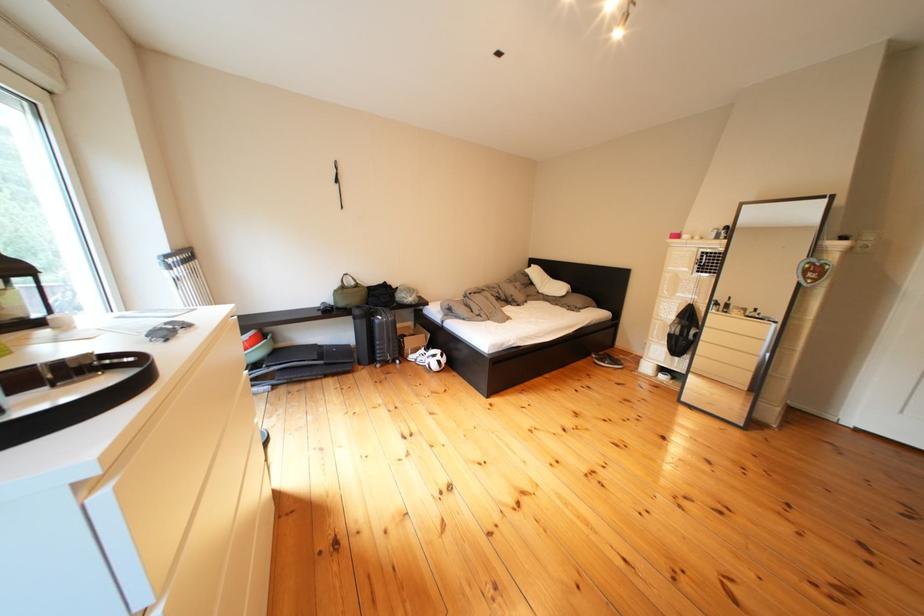
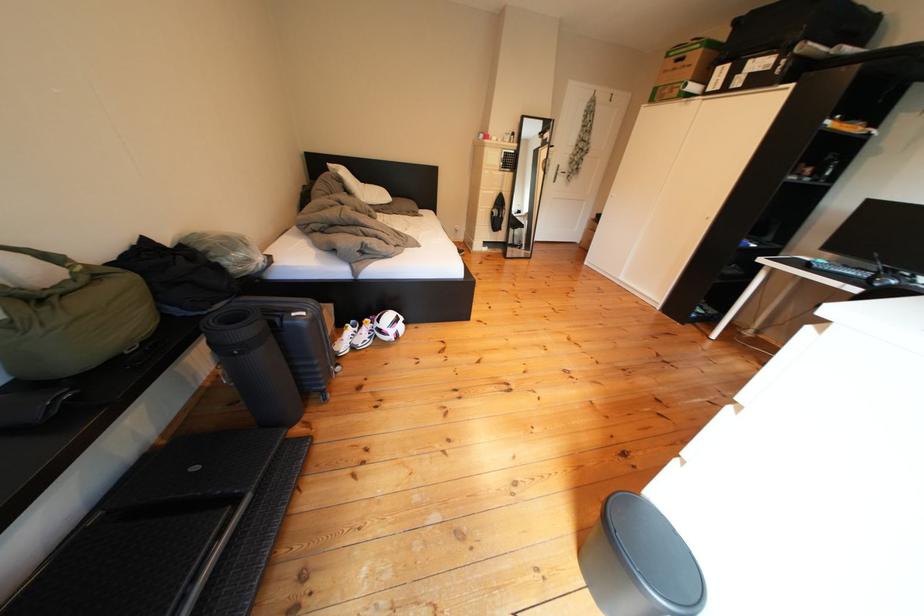
The point at (394,323) is marked in the first image. Where is the corresponding point in the second image?

(317, 318)